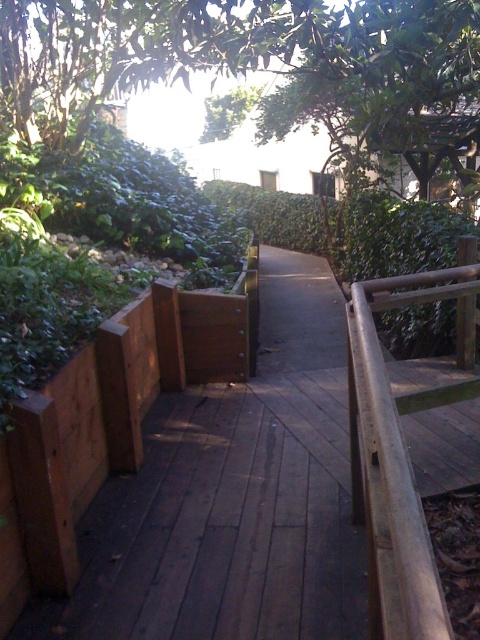
Question: Which object appears closest to the camera in this image?

Choices:
 (A) brown wooden rail at right
 (B) brown wooden deck at center

Answer: (A)

Question: Can you confirm if brown wooden deck at center is bigger than brown wooden rail at right?

Choices:
 (A) no
 (B) yes

Answer: (A)

Question: Which object appears closest to the camera in this image?

Choices:
 (A) brown wooden deck at center
 (B) brown wooden rail at right

Answer: (B)

Question: Is brown wooden deck at center wider than brown wooden rail at right?

Choices:
 (A) no
 (B) yes

Answer: (A)

Question: Does brown wooden deck at center have a lesser width compared to brown wooden rail at right?

Choices:
 (A) yes
 (B) no

Answer: (A)